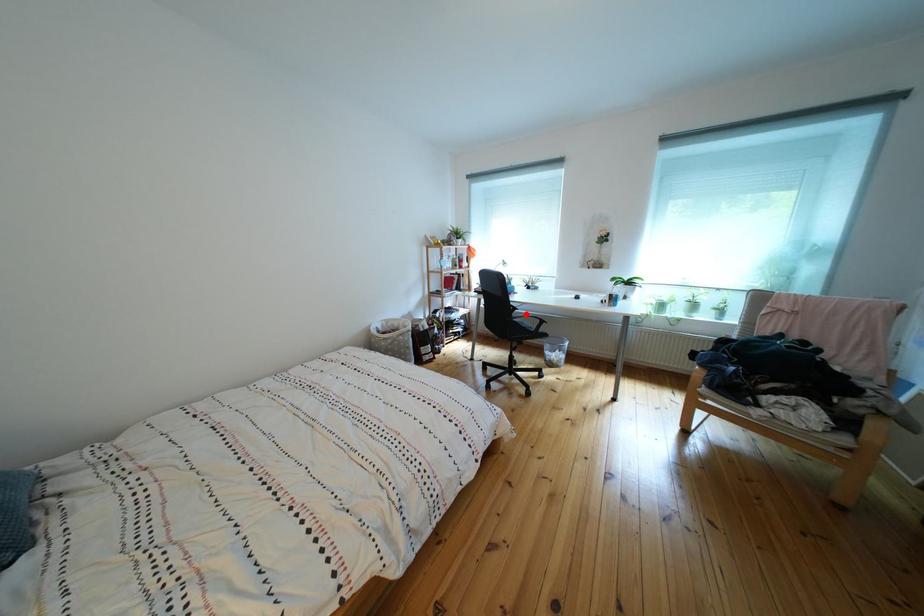
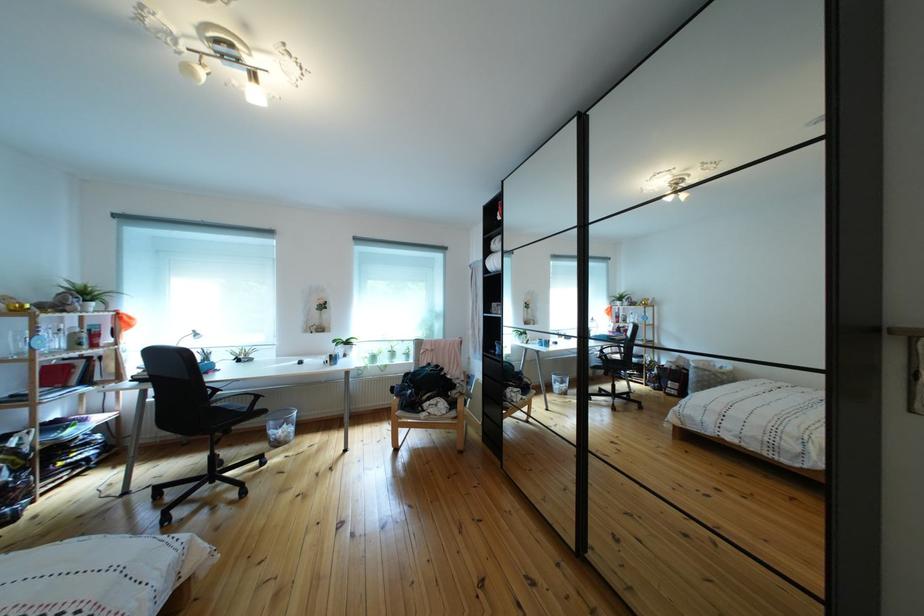
Where in the second image is the point corresponding to the highlighted location from the first image?

(227, 395)